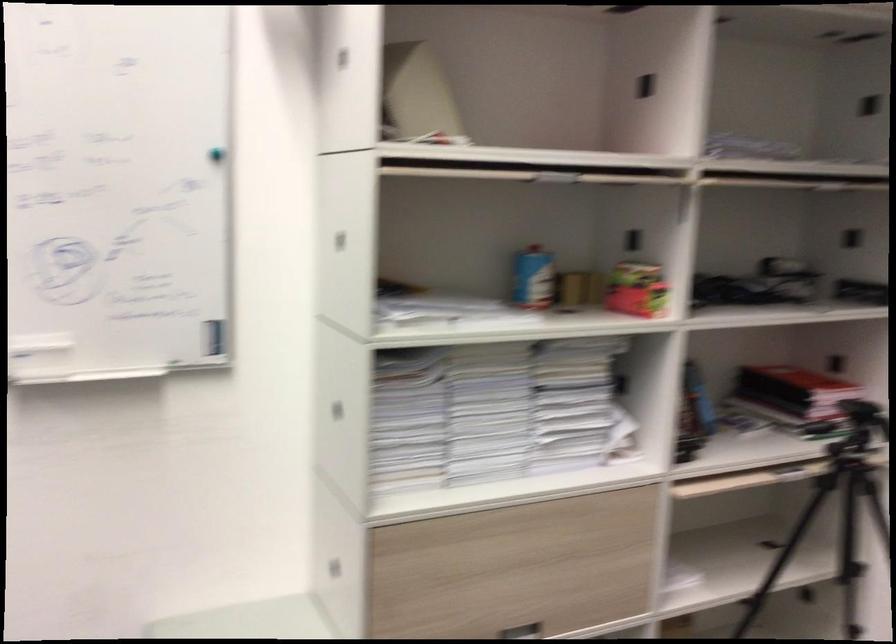
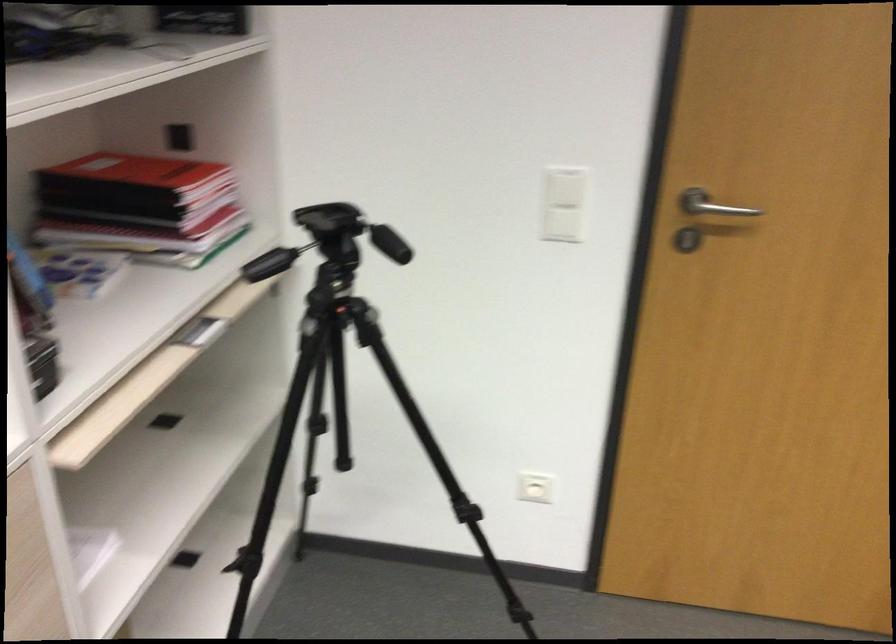
Find the pixel in the second image that matches [804,370] in the first image.

(133, 172)